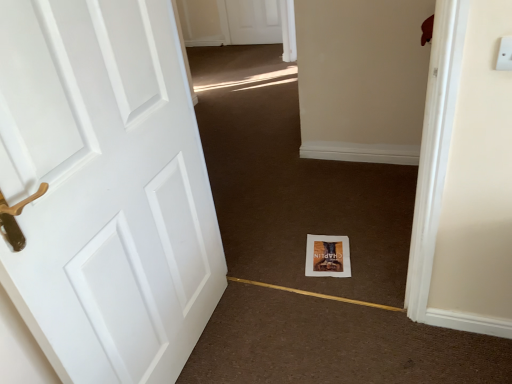
Locate an element on the screen. This screenshot has width=512, height=384. vacant region under matte paper book at center (from a real-world perspective) is located at coordinates (332, 264).